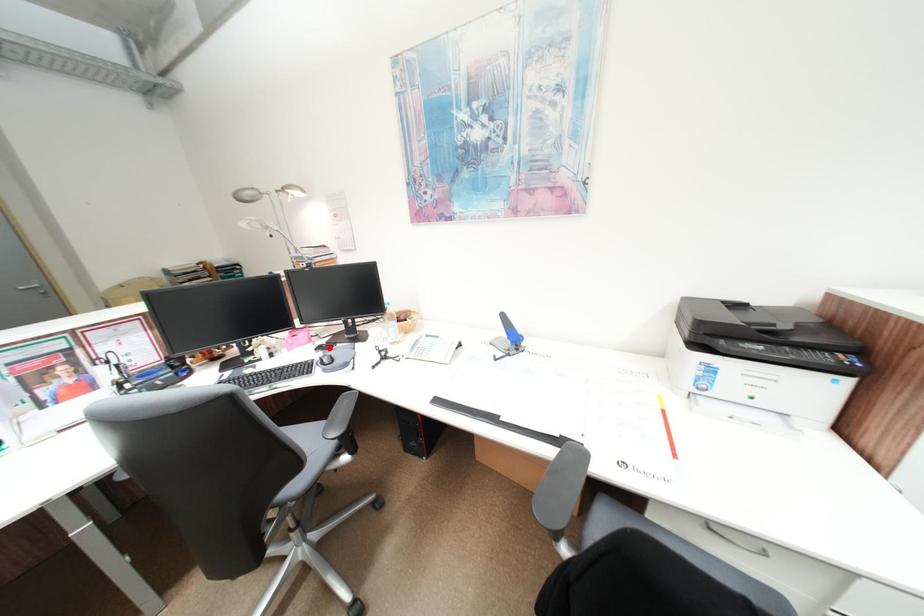
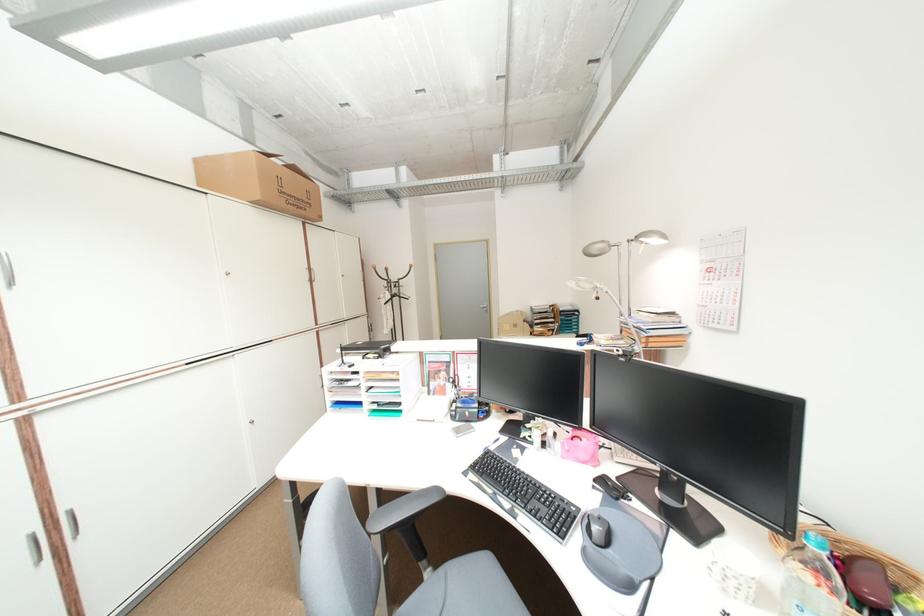
The point at the highlighted location is marked in the first image. Where is the corresponding point in the second image?

(613, 482)